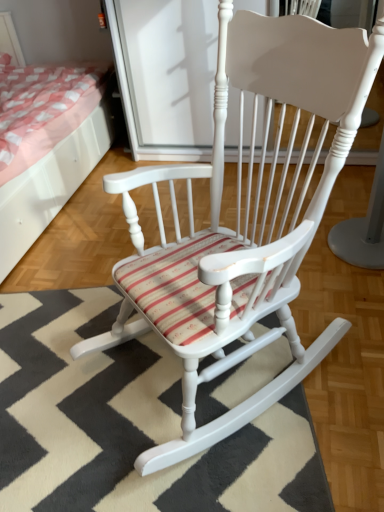
Question: From the image's perspective, is striped fabric doormat at center positioned above or below matte pink fabric bed at upper left?

Choices:
 (A) above
 (B) below

Answer: (B)

Question: Relative to matte pink fabric bed at upper left, is striped fabric doormat at center in front or behind?

Choices:
 (A) front
 (B) behind

Answer: (A)

Question: Would you say striped fabric doormat at center is inside or outside matte pink fabric bed at upper left?

Choices:
 (A) inside
 (B) outside

Answer: (B)

Question: Considering the positions of matte pink fabric bed at upper left and striped fabric doormat at center in the image, is matte pink fabric bed at upper left taller or shorter than striped fabric doormat at center?

Choices:
 (A) short
 (B) tall

Answer: (B)

Question: Considering the relative positions of matte pink fabric bed at upper left and striped fabric doormat at center in the image provided, is matte pink fabric bed at upper left to the left or to the right of striped fabric doormat at center?

Choices:
 (A) right
 (B) left

Answer: (B)

Question: Is matte pink fabric bed at upper left spatially inside striped fabric doormat at center, or outside of it?

Choices:
 (A) inside
 (B) outside

Answer: (B)

Question: From a real-world perspective, is matte pink fabric bed at upper left positioned above or below striped fabric doormat at center?

Choices:
 (A) above
 (B) below

Answer: (A)